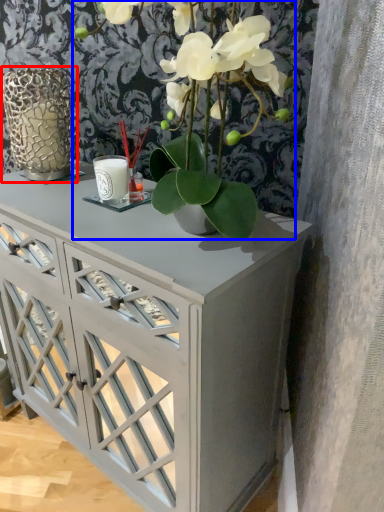
Question: Among these objects, which one is farthest to the camera, glass vase (highlighted by a red box) or houseplant (highlighted by a blue box)?

Choices:
 (A) glass vase
 (B) houseplant

Answer: (A)